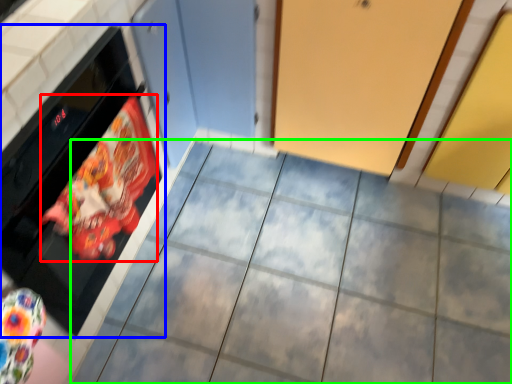
Question: Considering the real-world distances, which object is closest to material (highlighted by a red box)? oven (highlighted by a blue box) or ceramic tile (highlighted by a green box).

Choices:
 (A) oven
 (B) ceramic tile

Answer: (A)